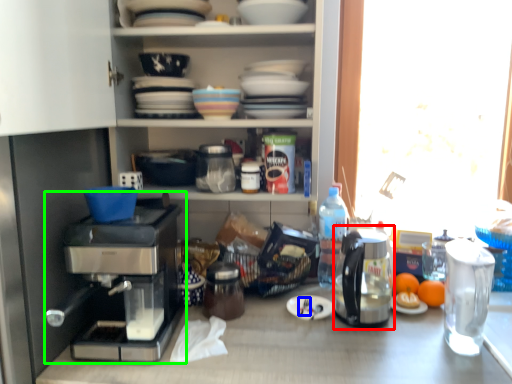
Question: Considering the real-world distances, which object is farthest from coffeepot (highlighted by a red box)? silverware (highlighted by a blue box) or coffee maker (highlighted by a green box)?

Choices:
 (A) silverware
 (B) coffee maker

Answer: (B)